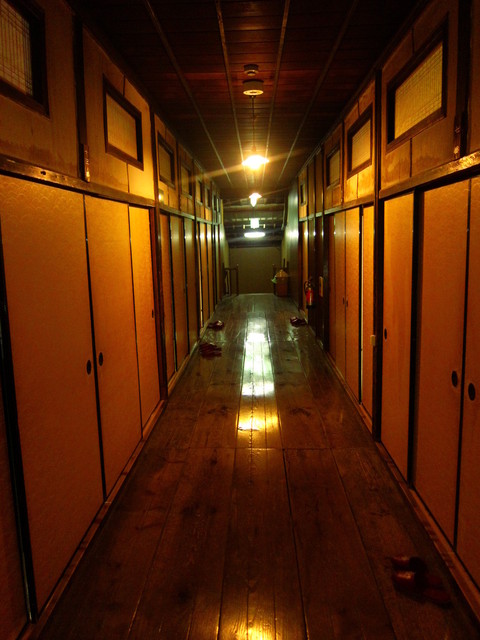
Locate an element on the screen. ceiling lights is located at coordinates (254, 162), (253, 195), (253, 233).